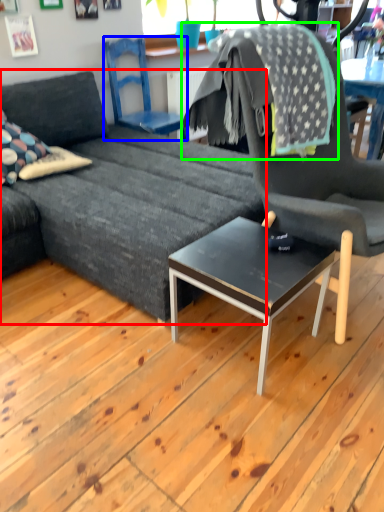
Question: Estimate the real-world distances between objects in this image. Which object is closer to studio couch (highlighted by a red box), chair (highlighted by a blue box) or blanket (highlighted by a green box)?

Choices:
 (A) chair
 (B) blanket

Answer: (B)